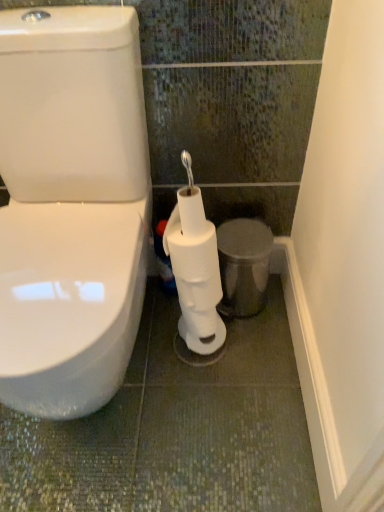
Question: Can you confirm if white matte toilet paper at center, which is counted as the second toilet paper, starting from the bottom, is positioned to the right of metallic silver trash can at lower right?

Choices:
 (A) yes
 (B) no

Answer: (B)

Question: Does white matte toilet paper at center, which ranks as the first toilet paper in top-to-bottom order, turn towards metallic silver trash can at lower right?

Choices:
 (A) yes
 (B) no

Answer: (B)

Question: From a real-world perspective, is white matte toilet paper at center, which is counted as the second toilet paper, starting from the bottom, on top of metallic silver trash can at lower right?

Choices:
 (A) yes
 (B) no

Answer: (A)

Question: Does white matte toilet paper at center, which ranks as the first toilet paper in top-to-bottom order, touch metallic silver trash can at lower right?

Choices:
 (A) yes
 (B) no

Answer: (B)

Question: From the image's perspective, is white matte toilet paper at center, which ranks as the first toilet paper in top-to-bottom order, above metallic silver trash can at lower right?

Choices:
 (A) yes
 (B) no

Answer: (A)

Question: From a real-world perspective, is white matte toilet paper at center, which ranks as the first toilet paper in top-to-bottom order, below metallic silver trash can at lower right?

Choices:
 (A) yes
 (B) no

Answer: (B)

Question: Can you confirm if white matte toilet paper at center, which ranks as the first toilet paper in top-to-bottom order, is wider than white matte toilet paper at center, which is the 1th toilet paper from bottom to top?

Choices:
 (A) yes
 (B) no

Answer: (B)

Question: Is white matte toilet paper at center, which ranks as the first toilet paper in top-to-bottom order, in contact with white matte toilet paper at center, the 2th toilet paper when ordered from top to bottom?

Choices:
 (A) no
 (B) yes

Answer: (B)

Question: From a real-world perspective, is white matte toilet paper at center, which ranks as the first toilet paper in top-to-bottom order, on white matte toilet paper at center, which is the 1th toilet paper from bottom to top?

Choices:
 (A) yes
 (B) no

Answer: (A)

Question: Is white matte toilet paper at center, which ranks as the first toilet paper in top-to-bottom order, further to camera compared to white matte toilet paper at center, the 2th toilet paper when ordered from top to bottom?

Choices:
 (A) yes
 (B) no

Answer: (A)

Question: From the image's perspective, is white matte toilet paper at center, which ranks as the first toilet paper in top-to-bottom order, above white matte toilet paper at center, which is the 1th toilet paper from bottom to top?

Choices:
 (A) no
 (B) yes

Answer: (B)

Question: Does white matte toilet paper at center, which is counted as the second toilet paper, starting from the bottom, turn towards white matte toilet paper at center, which is the 1th toilet paper from bottom to top?

Choices:
 (A) yes
 (B) no

Answer: (A)

Question: Is white matte toilet paper at center, the 2th toilet paper when ordered from top to bottom, taller than metallic silver trash can at lower right?

Choices:
 (A) no
 (B) yes

Answer: (B)